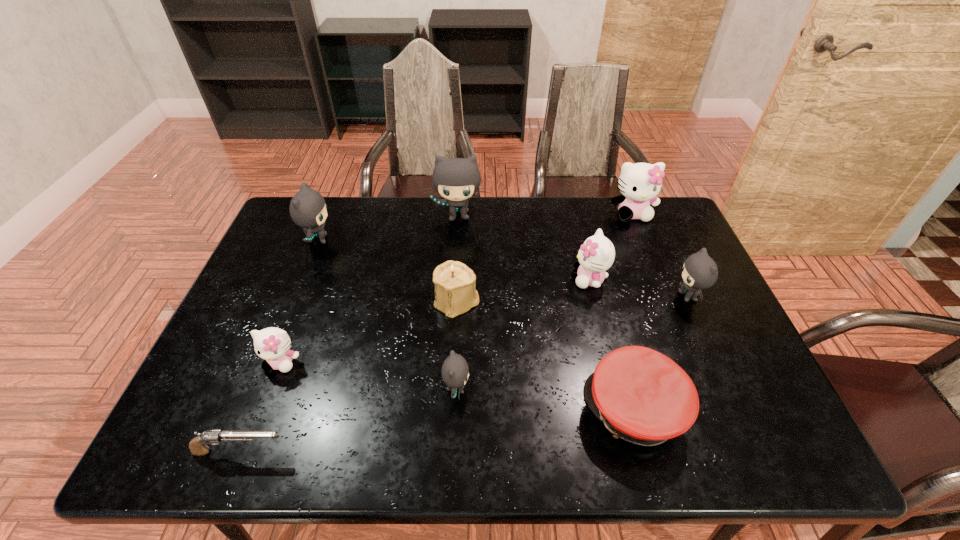
Find the location of a particular element. This screenshot has width=960, height=540. vacant space located 0.330m on the back of the candle_holder is located at coordinates (461, 216).

The image size is (960, 540). Identify the location of vacant space situated 0.290m on the front-facing side of the second smallest gray kitten. (569, 296).

Find the location of `vacant point located on the front-facing side of the second smallest gray kitten`. vacant point located on the front-facing side of the second smallest gray kitten is located at coordinates (555, 296).

This screenshot has width=960, height=540. Find the location of `vacant region located on the front-facing side of the second smallest gray kitten`. vacant region located on the front-facing side of the second smallest gray kitten is located at coordinates (552, 296).

Identify the location of free space located on the front-facing side of the nearest white kitten. (253, 436).

Identify the location of free region located 0.370m on the front-facing side of the smallest gray kitten. Image resolution: width=960 pixels, height=540 pixels. (629, 389).

Identify the location of free point located 0.160m at the front of the cap where the visor is located. Image resolution: width=960 pixels, height=540 pixels. (515, 410).

Identify the location of vacant space positioned 0.320m at the front of the cap where the visor is located. The width and height of the screenshot is (960, 540). (444, 410).

This screenshot has height=540, width=960. In order to click on blank space located 0.350m at the front of the cap where the visor is located in this screenshot , I will do `click(430, 410)`.

Locate an element on the screen. This screenshot has height=540, width=960. vacant space positioned 0.330m aiming along the barrel of the shortest object is located at coordinates (445, 451).